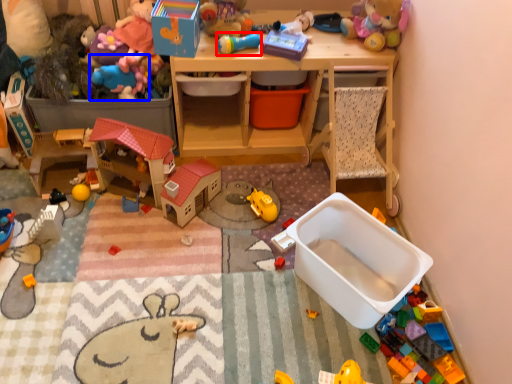
Question: Among these objects, which one is nearest to the camera, toy (highlighted by a red box) or toy (highlighted by a blue box)?

Choices:
 (A) toy
 (B) toy

Answer: (A)